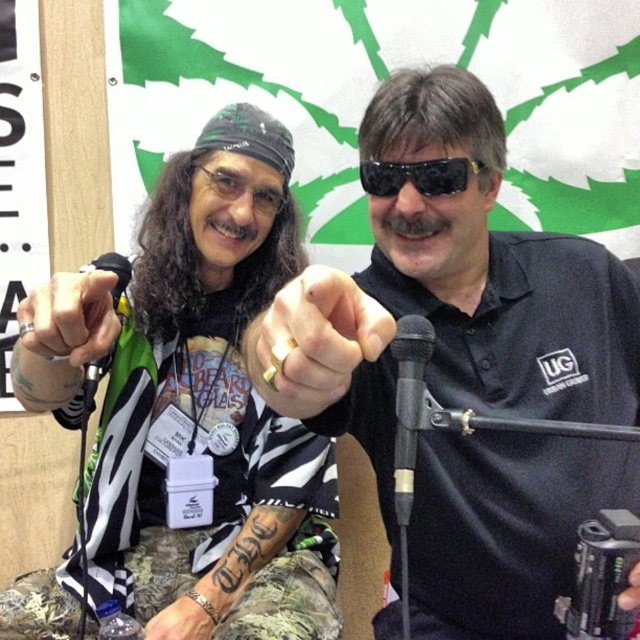
Question: Can you confirm if gold ring at center is positioned above black matte microphone at center?

Choices:
 (A) yes
 (B) no

Answer: (A)

Question: Considering the relative positions of black matte sunglasses at center and black plastic sunglasses at center in the image provided, where is black matte sunglasses at center located with respect to black plastic sunglasses at center?

Choices:
 (A) left
 (B) right

Answer: (A)

Question: In this image, where is gold ring at center located relative to camouflage-patterned hand at lower left?

Choices:
 (A) below
 (B) above

Answer: (B)

Question: Among these objects, which one is nearest to the camera?

Choices:
 (A) gold ring at center
 (B) black matte microphone at center
 (C) black plastic sunglasses at center
 (D) camouflage-patterned hand at lower left

Answer: (A)

Question: Which object is the closest to the black matte finger at center?

Choices:
 (A) camouflage-patterned hand at lower left
 (B) black matte microphone at center
 (C) black plastic sunglasses at center
 (D) gold ring at center

Answer: (D)

Question: Which point is farther to the camera?

Choices:
 (A) black plastic sunglasses at center
 (B) camouflage-patterned hand at lower left
 (C) black matte sunglasses at center
 (D) zebra print shirt at center

Answer: (B)